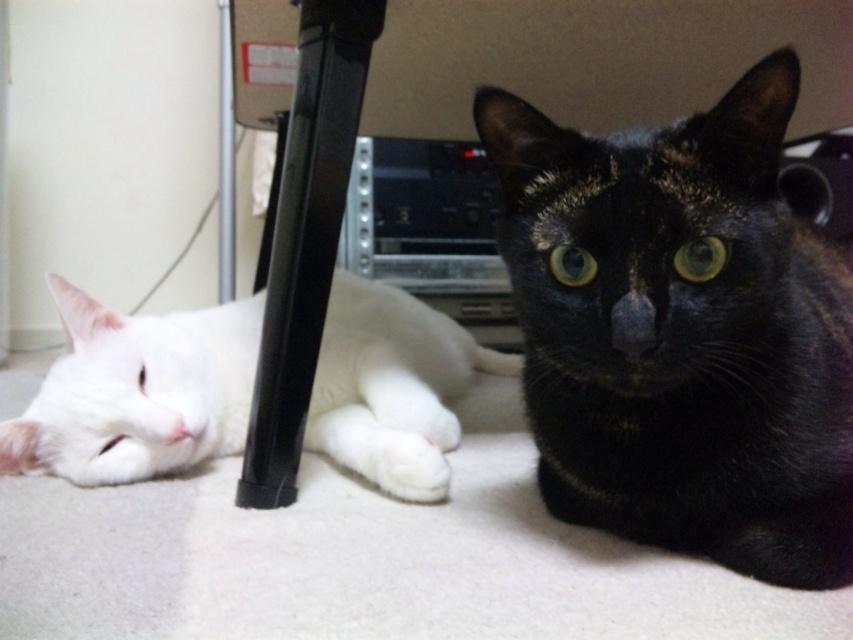
Question: Can you confirm if black glossy cat at center is positioned above white fluffy cat at left?

Choices:
 (A) no
 (B) yes

Answer: (B)

Question: Which of the following is the closest to the observer?

Choices:
 (A) black glossy cat at center
 (B) white fluffy cat at left

Answer: (A)

Question: Is black glossy cat at center to the right of white fluffy cat at left from the viewer's perspective?

Choices:
 (A) yes
 (B) no

Answer: (A)

Question: Which point appears closest to the camera in this image?

Choices:
 (A) (425, 500)
 (B) (735, 284)

Answer: (B)

Question: Which of the following is the closest to the observer?

Choices:
 (A) white fluffy cat at left
 (B) black glossy cat at center

Answer: (B)

Question: Is black glossy cat at center above white fluffy cat at left?

Choices:
 (A) yes
 (B) no

Answer: (A)